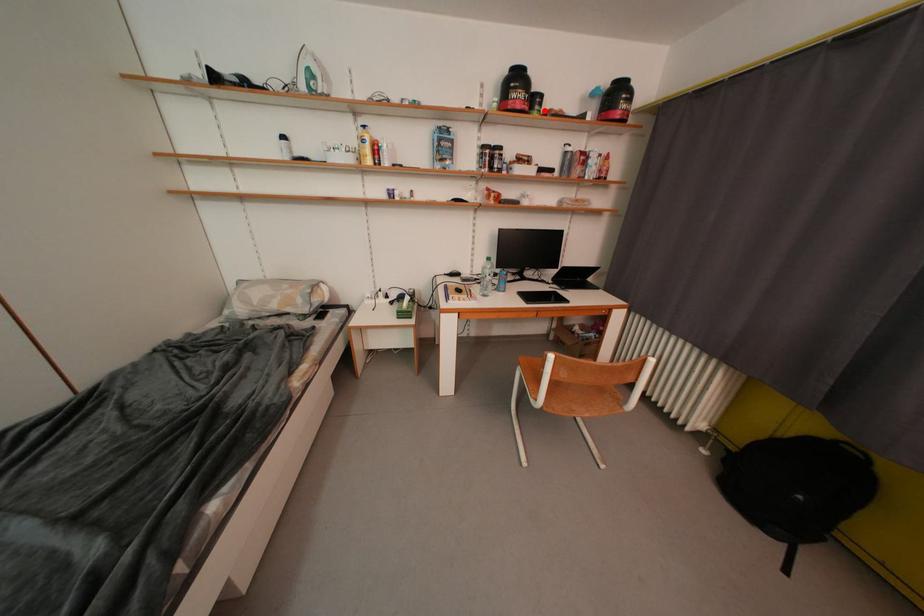
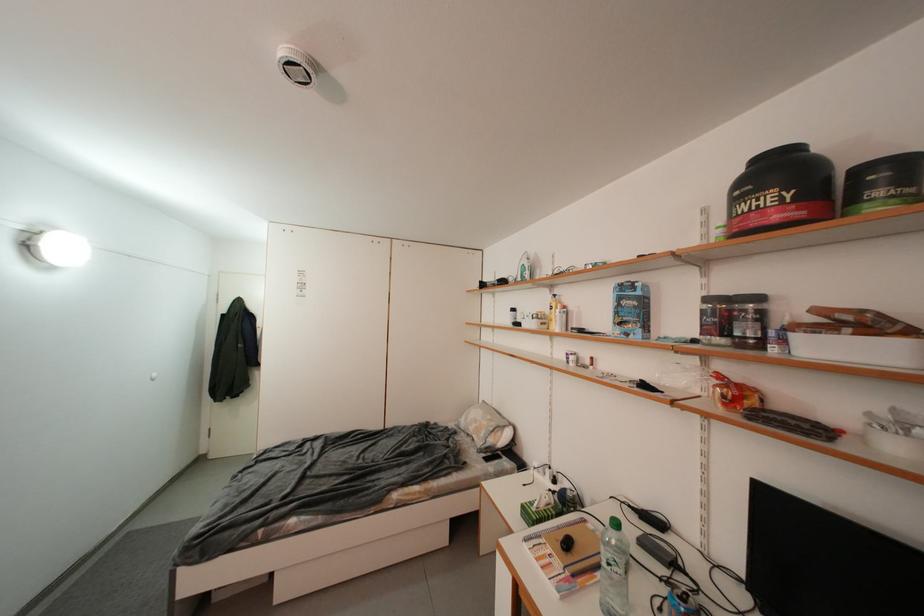
Locate, in the second image, the point that corresponds to the highlighted location in the first image.

(886, 196)